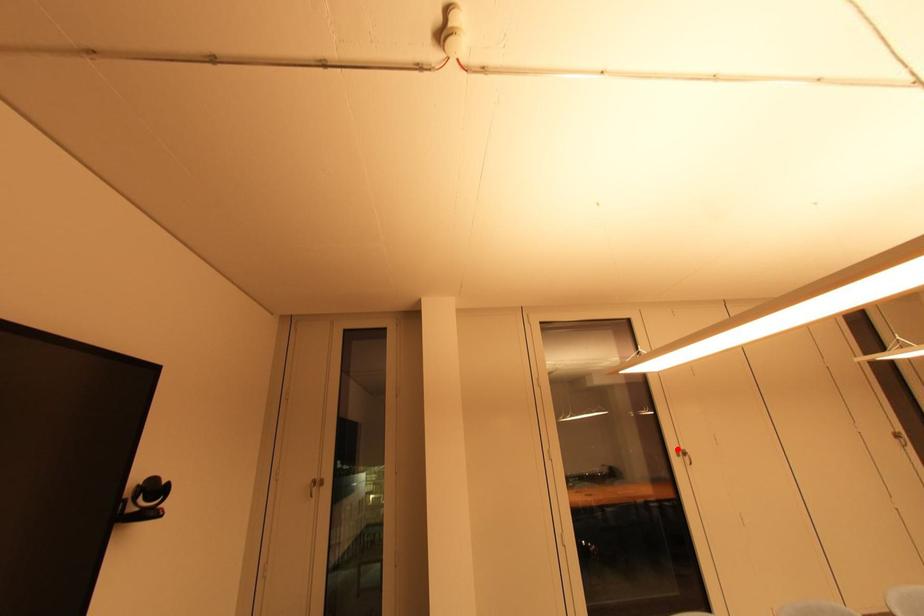
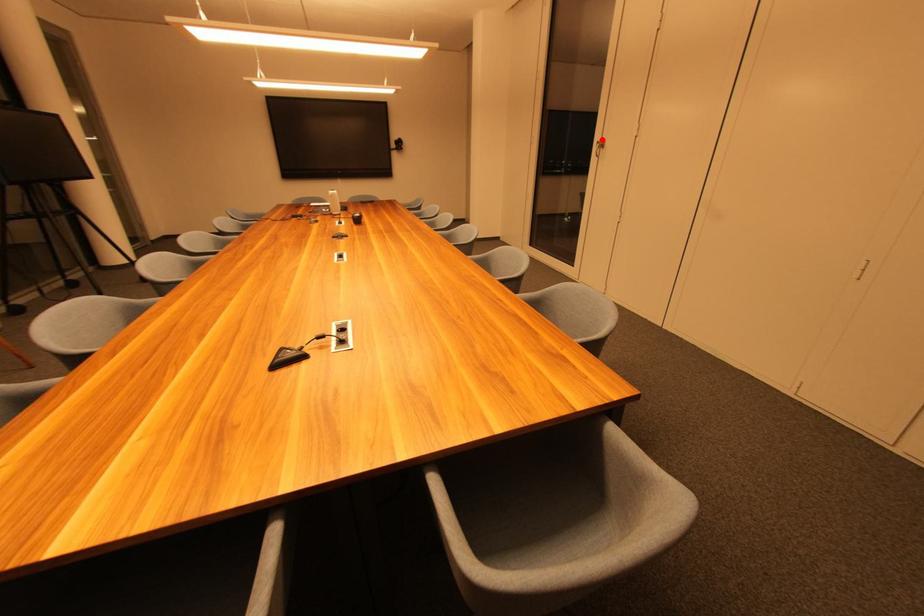
I am providing you with two images of the same scene from different viewpoints. A red point is marked on the first image and another point is marked on the second image. Is the red point in image1 aligned with the point shown in image2?

Yes